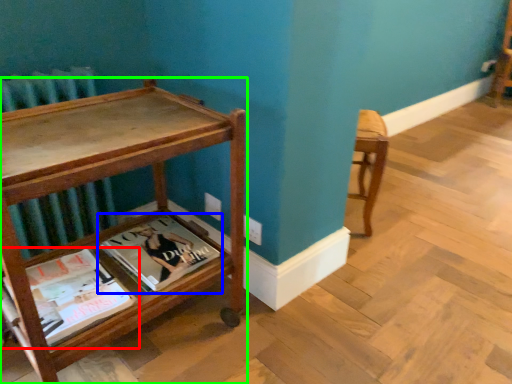
Question: Estimate the real-world distances between objects in this image. Which object is farther from book (highlighted by a red box), book (highlighted by a blue box) or table (highlighted by a green box)?

Choices:
 (A) book
 (B) table

Answer: (B)